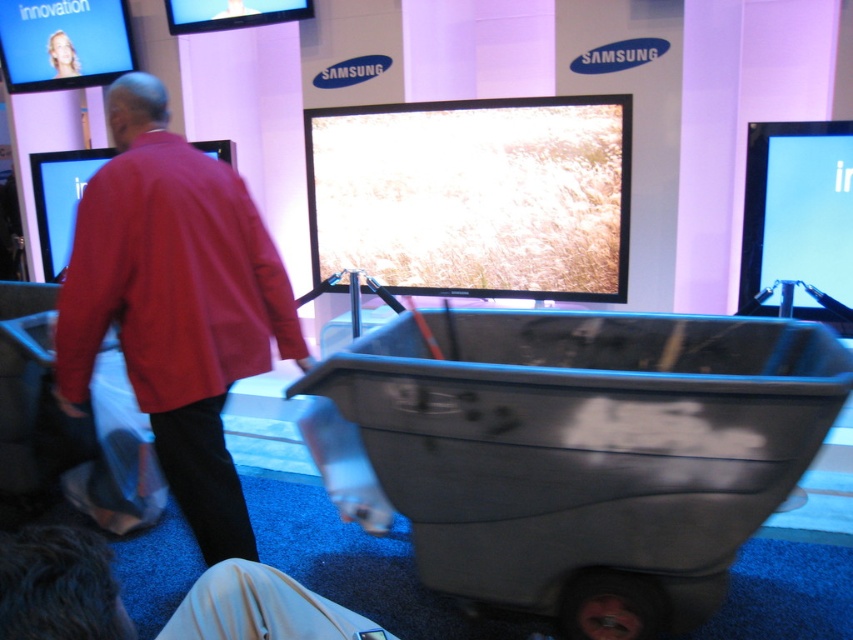
Question: Among these points, which one is nearest to the camera?

Choices:
 (A) (749, 340)
 (B) (190, 388)

Answer: (B)

Question: Does gray plastic cart at center come in front of red cotton shirt at center?

Choices:
 (A) yes
 (B) no

Answer: (A)

Question: Does gray plastic cart at center appear on the right side of red cotton shirt at center?

Choices:
 (A) yes
 (B) no

Answer: (A)

Question: Which object appears closest to the camera in this image?

Choices:
 (A) red cotton shirt at center
 (B) gray plastic cart at center

Answer: (B)

Question: Does gray plastic cart at center appear over red cotton shirt at center?

Choices:
 (A) yes
 (B) no

Answer: (B)